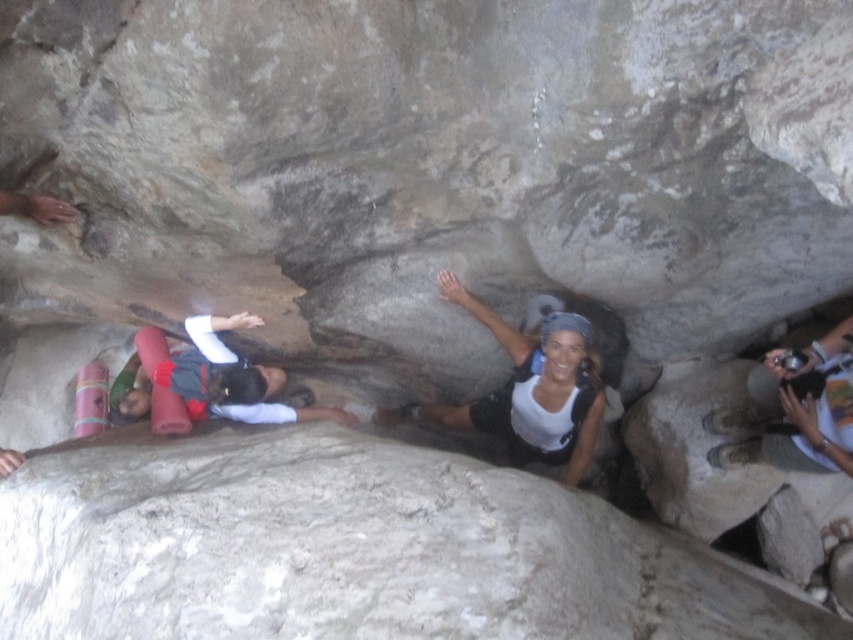
You are a photographer trying to capture a shot of the white matte tank top at center and the white fabric camera at right. Which object should you focus on first if you want to ensure both are in focus without adjusting the camera settings?

You should focus on the white matte tank top at center first because it is closer to the viewer than the white fabric camera at right. By focusing on the closer object, the farther object may still be within the depth of field, ensuring both are in focus without needing to adjust the camera settings.